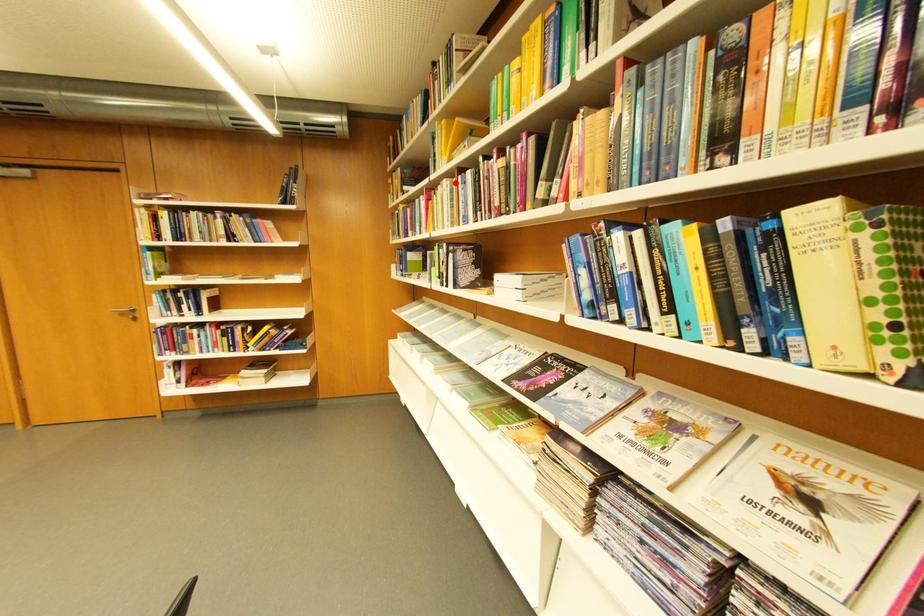
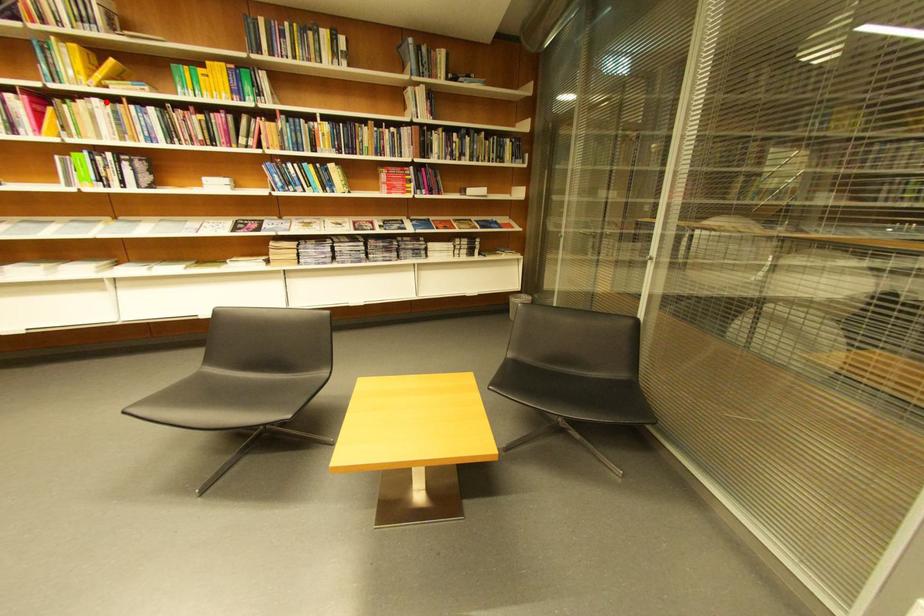
From the picture: I am providing you with two images of the same scene from different viewpoints. A red point is marked on the first image and another point is marked on the second image. Is the marked point in image1 the same physical position as the marked point in image2?

Yes